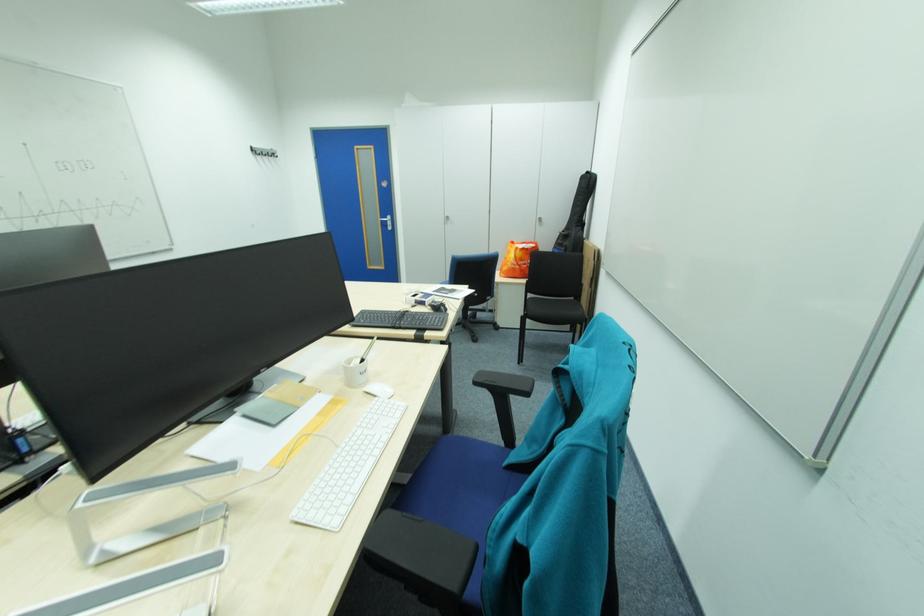
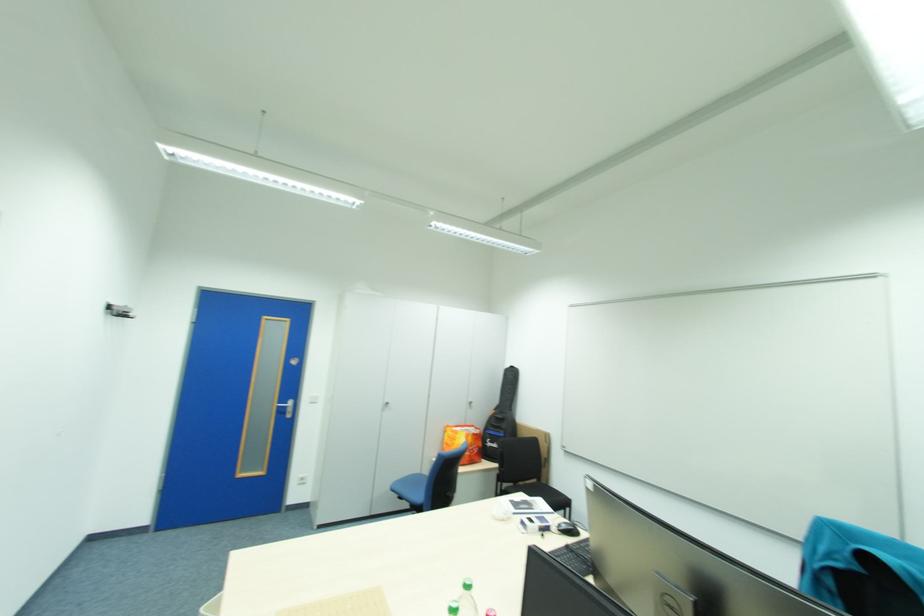
In the second image, find the point that corresponds to (435,304) in the first image.

(563, 529)